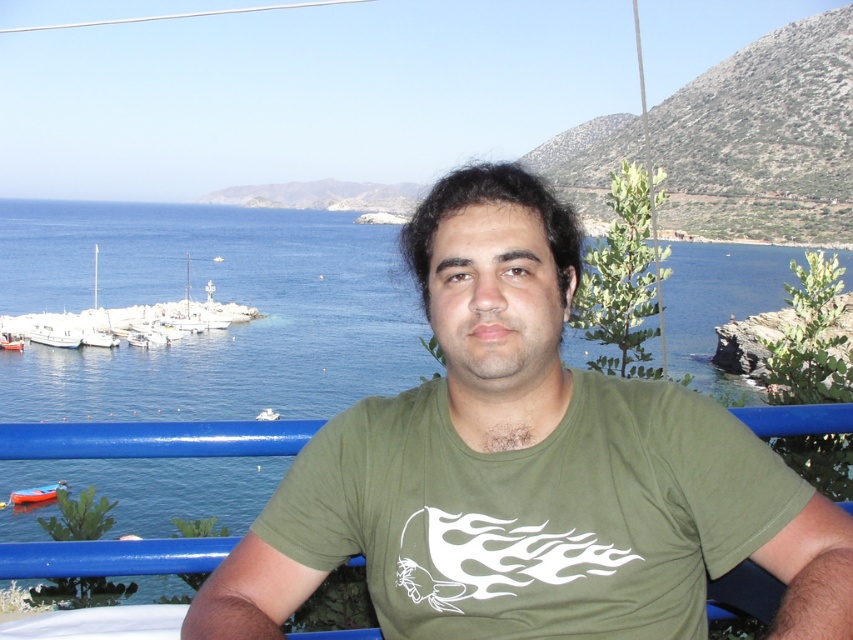
You are planning to dock a new boat that is 3 meters wide. Looking at the white matte boats at left and the orange fiberglass boat at lower left, which existing boat could potentially accommodate your new boat if width is the only concern?

The white matte boats at left might be wider than orange fiberglass boat at lower left, so the white matte boats at left could potentially accommodate the new boat if width is the only concern.